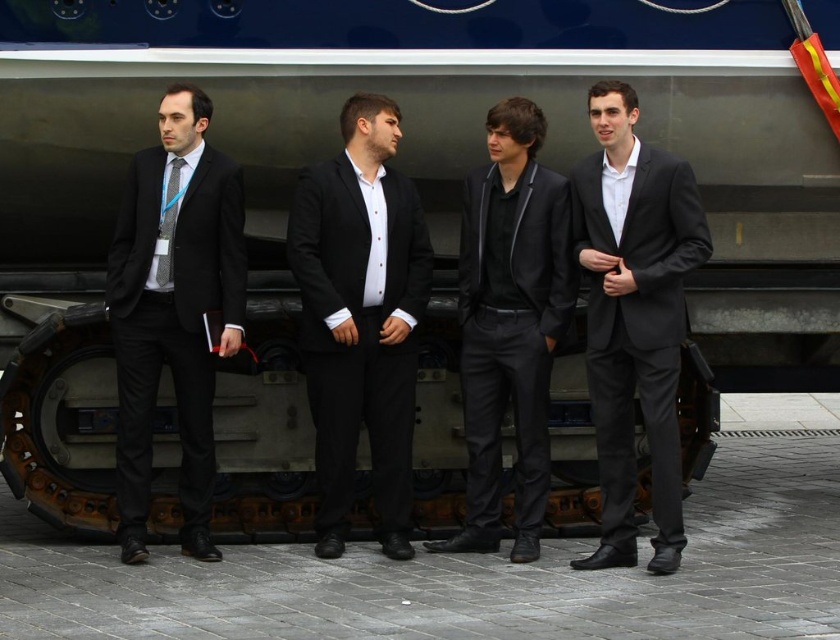
Which is in front, point (644, 369) or point (174, 212)?

Positioned in front is point (644, 369).

Which is behind, point (621, 314) or point (163, 244)?

The point (163, 244) is more distant.

Is point (665, 484) positioned before point (171, 241)?

Yes, point (665, 484) is closer to viewer.

At what (x,y) coordinates should I click in order to perform the action: click on matte black suit at right. Please return your answer as a coordinate pair (x, y). The image size is (840, 640). Looking at the image, I should click on (634, 316).

Which is in front, point (308, 384) or point (193, 544)?

Point (193, 544) is more forward.

Measure the distance between point (324, 209) and camera.

7.72 meters

I want to click on black matte suit at center, so click(x=360, y=317).

Can you confirm if matte black suit at left is bigger than matte black suit at center?

Incorrect, matte black suit at left is not larger than matte black suit at center.

Is point (137, 285) farther from camera compared to point (460, 540)?

No.

Find the location of `matte black suit at left`. matte black suit at left is located at coordinates (172, 308).